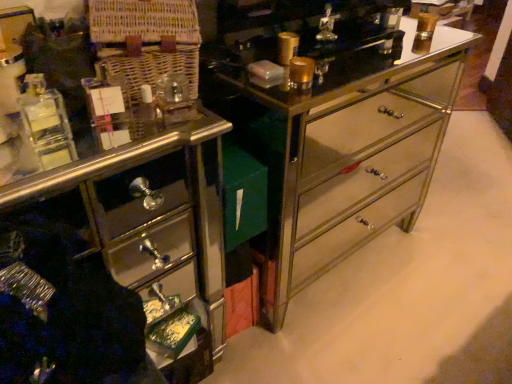
Question: From their relative heights in the image, would you say metallic mirrored dresser at center is taller or shorter than shiny mirrored drawer at lower left?

Choices:
 (A) short
 (B) tall

Answer: (B)

Question: In the image, is metallic mirrored dresser at center positioned in front of or behind shiny mirrored drawer at lower left?

Choices:
 (A) front
 (B) behind

Answer: (B)

Question: From a real-world perspective, is metallic mirrored dresser at center positioned above or below shiny mirrored drawer at lower left?

Choices:
 (A) below
 (B) above

Answer: (A)

Question: Is shiny mirrored drawer at lower left taller or shorter than metallic mirrored dresser at center?

Choices:
 (A) short
 (B) tall

Answer: (A)

Question: Is shiny mirrored drawer at lower left wider or thinner than metallic mirrored dresser at center?

Choices:
 (A) thin
 (B) wide

Answer: (A)

Question: Is shiny mirrored drawer at lower left in front of or behind metallic mirrored dresser at center in the image?

Choices:
 (A) behind
 (B) front

Answer: (B)

Question: Is shiny mirrored drawer at lower left inside the boundaries of metallic mirrored dresser at center, or outside?

Choices:
 (A) inside
 (B) outside

Answer: (B)